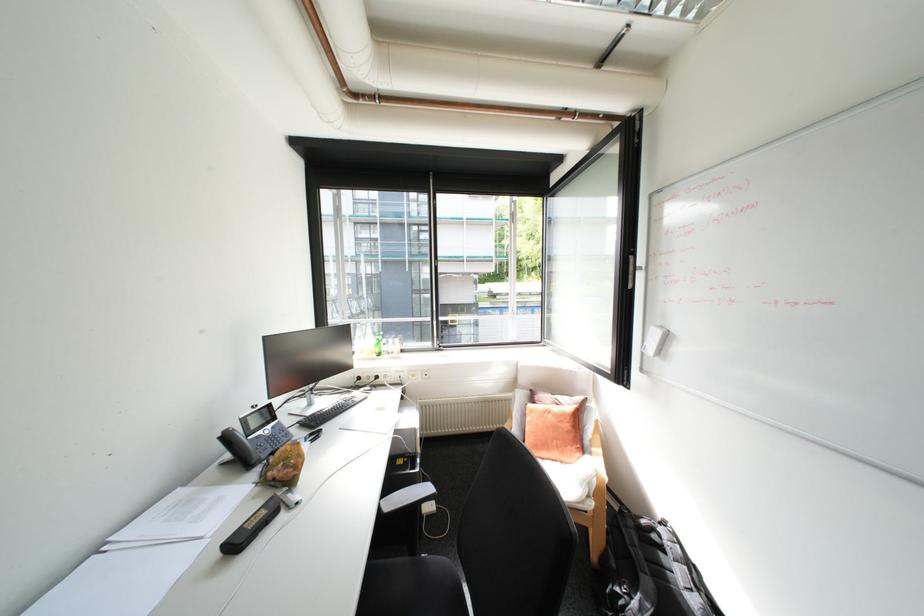
Which object does [649,570] point to?

This point indicates the black backpack.